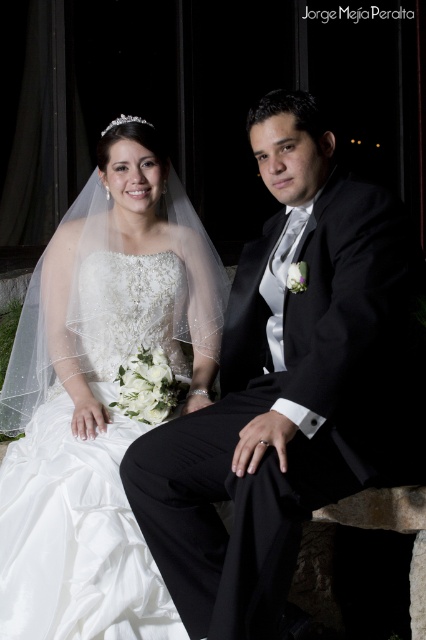
What do you see at coordinates (287, 387) in the screenshot? This screenshot has height=640, width=426. I see `black satin suit at center` at bounding box center [287, 387].

Is black satin suit at center further to camera compared to white satin dress at center?

No, it is not.

Does point (340, 420) lie in front of point (19, 609)?

Yes, it is in front of point (19, 609).

Where is `black satin suit at center`? This screenshot has height=640, width=426. black satin suit at center is located at coordinates pyautogui.click(x=287, y=387).